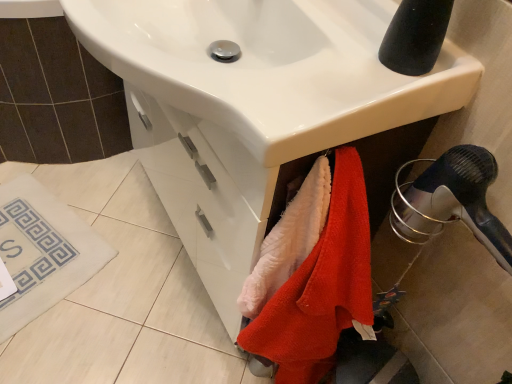
This screenshot has width=512, height=384. Identify the location of blank space situated above white fabric bath mat at lower left (from a real-world perspective). (32, 243).